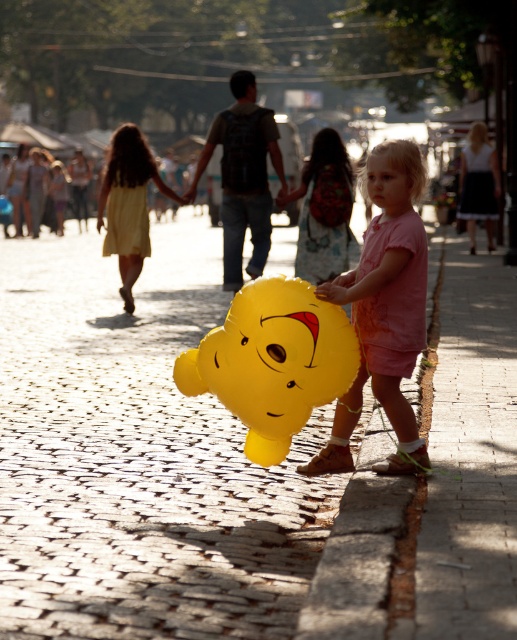
Is point (40, 376) positioned behind point (388, 212)?

Yes, point (40, 376) is farther from viewer.

Consider the image. Between yellow balloon at center and smooth skin face at center, which one appears on the right side from the viewer's perspective?

From the viewer's perspective, smooth skin face at center appears more on the right side.

Find the location of a particular element. yellow balloon at center is located at coordinates (164, 468).

Is point (425, 465) positioned in front of point (141, 228)?

Yes, point (425, 465) is in front of point (141, 228).

Locate an element on the screen. The width and height of the screenshot is (517, 640). pink matte dress at center is located at coordinates (384, 324).

In order to click on pink matte dress at center in this screenshot , I will do `click(384, 324)`.

Between point (458, 305) and point (235, 340), which one is positioned in front?

Point (235, 340) is in front.

The image size is (517, 640). Find the location of `yellow balloon at center`. yellow balloon at center is located at coordinates (164, 468).